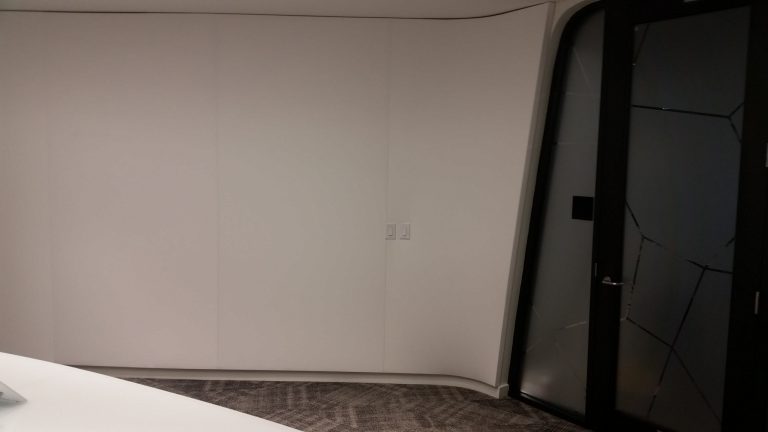
Find the location of a particular element. The height and width of the screenshot is (432, 768). frosted glass is located at coordinates (659, 216), (541, 275), (672, 128).